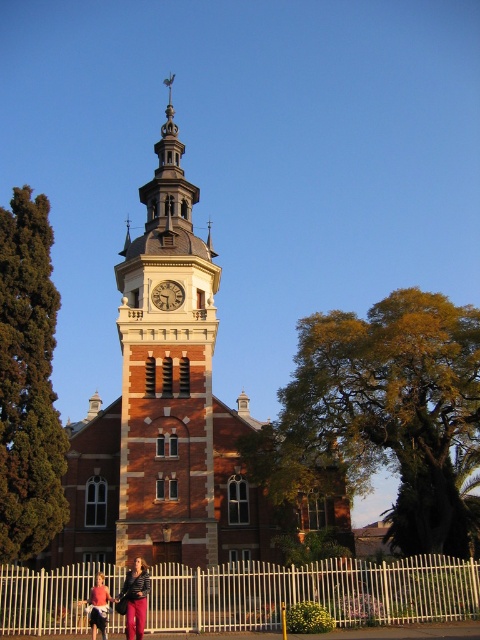
You are standing in front of the historic building and notice the brown brick church at center and the matte black jacket at lower left. Which object is taller?

The brown brick church at center is taller than the matte black jacket at lower left according to the description.

You are standing in a park and see the brown brick church at center and the denim pants at lower left in the distance. Which object is closer to you?

The brown brick church at center is closer to you because it is further to the viewer than the denim pants at lower left.